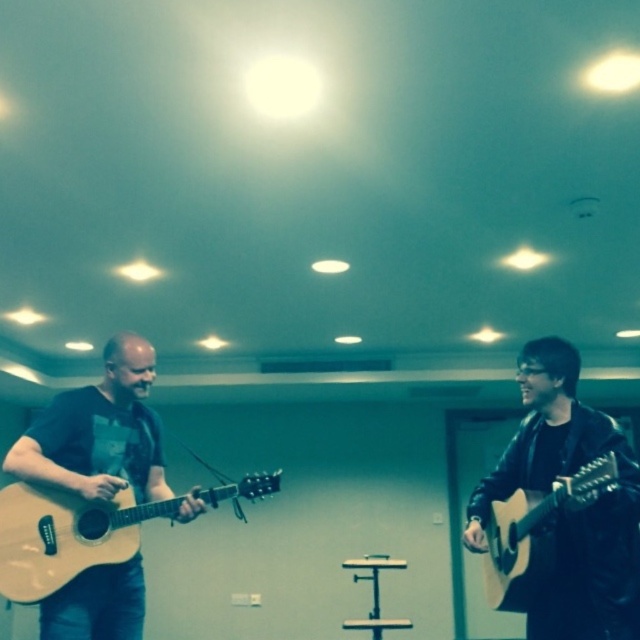
Is the position of matte black guitar at right less distant than that of matte brown acoustic guitar at right?

No, it is behind matte brown acoustic guitar at right.

How distant is matte black guitar at right from matte brown acoustic guitar at right?

A distance of 4.53 inches exists between matte black guitar at right and matte brown acoustic guitar at right.

Identify the location of matte black guitar at right. (572, 515).

Which is below, matte black guitar at right or light brown acoustic guitar at left?

light brown acoustic guitar at left

Is matte black guitar at right thinner than light brown acoustic guitar at left?

Correct, matte black guitar at right's width is less than light brown acoustic guitar at left's.

Is point (566, 464) in front of point (106, 520)?

Yes, it is in front of point (106, 520).

Locate an element on the screen. matte black guitar at right is located at coordinates (572, 515).

Which is in front, point (120, 484) or point (83, 499)?

Point (120, 484) is in front.

Is matte black guitar at left thinner than light brown acoustic guitar at left?

Yes.

Is point (108, 413) closer to viewer compared to point (104, 556)?

No, it is behind (104, 556).

Identify the location of matte black guitar at left. The image size is (640, 640). (99, 433).